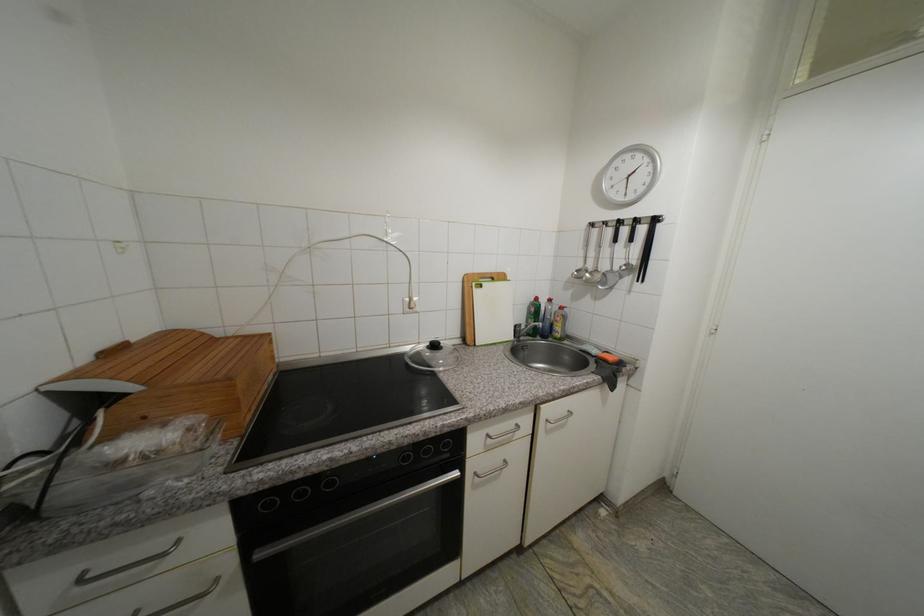
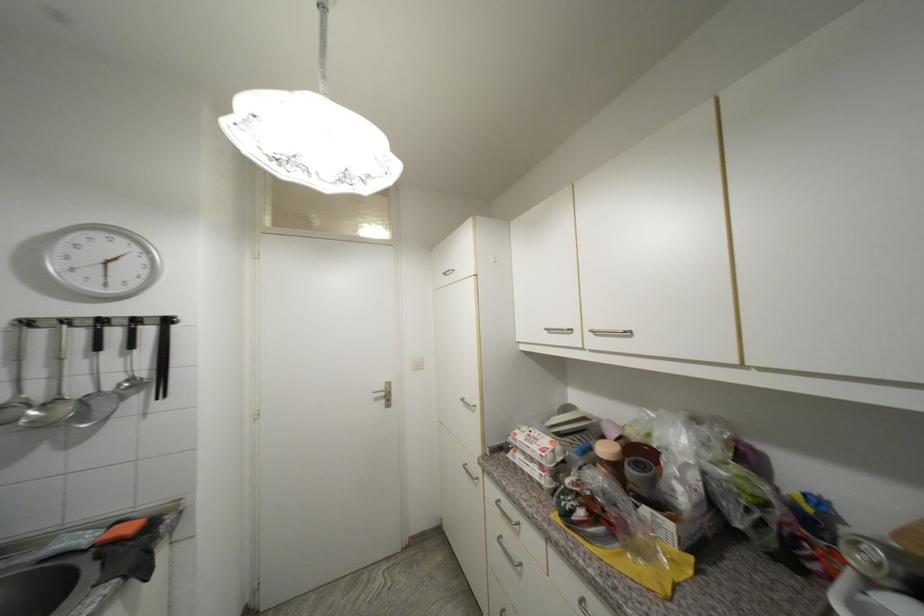
Find the pixel in the second image that matches (x=616, y=360) in the first image.

(137, 530)